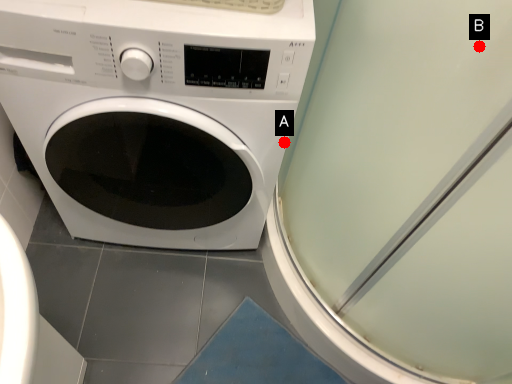
Question: Two points are circled on the image, labeled by A and B beside each circle. Which of the following is the closest to the observer?

Choices:
 (A) A is closer
 (B) B is closer

Answer: (B)